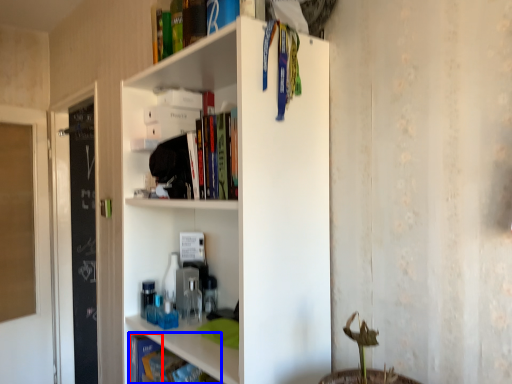
Question: Which point is closer to the camera, book (highlighted by a red box) or book (highlighted by a blue box)?

Choices:
 (A) book
 (B) book

Answer: (B)